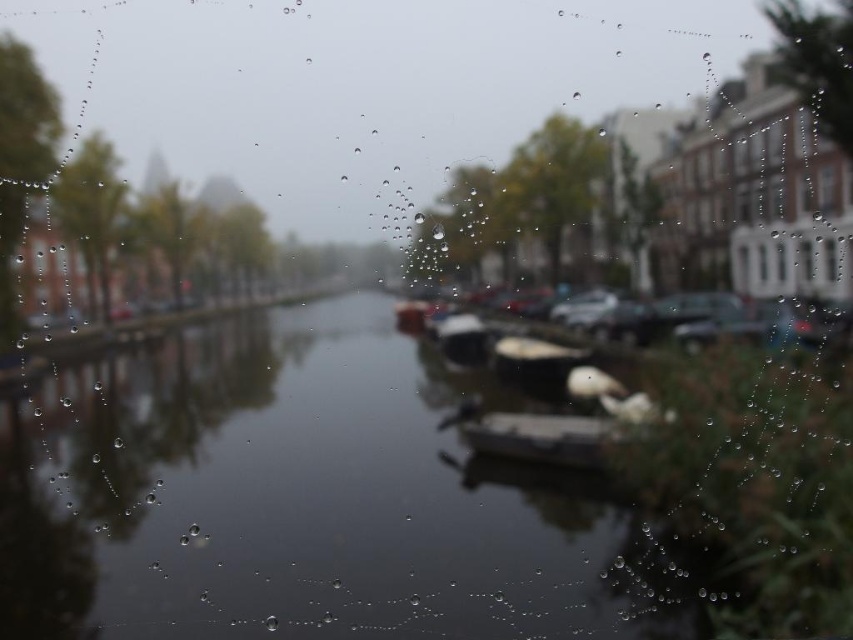
Question: Is smooth white boat at center positioned at the back of metallic silver boat at center?

Choices:
 (A) no
 (B) yes

Answer: (B)

Question: Which point appears farthest from the camera in this image?

Choices:
 (A) (579, 364)
 (B) (534, 456)
 (C) (9, 499)

Answer: (A)

Question: Is the position of smooth gray boat at center more distant than that of smooth white boat at center?

Choices:
 (A) yes
 (B) no

Answer: (B)

Question: Does smooth gray boat at center come in front of metallic silver boat at center?

Choices:
 (A) yes
 (B) no

Answer: (A)

Question: Which of these objects is positioned closest to the smooth white boat at center?

Choices:
 (A) transparent water at center
 (B) smooth gray boat at center

Answer: (B)

Question: Which of the following is the closest to the observer?

Choices:
 (A) smooth white boat at center
 (B) transparent water at center
 (C) metallic silver boat at center
 (D) smooth gray boat at center

Answer: (B)